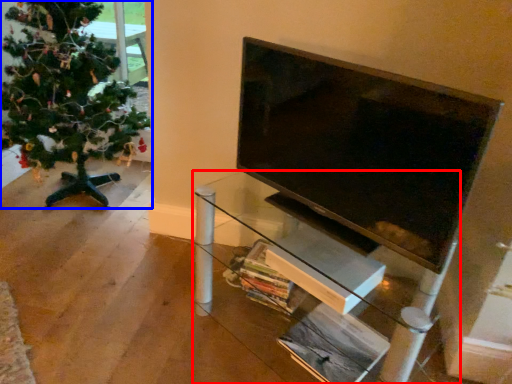
Question: Which of the following is the farthest to the observer, furniture (highlighted by a red box) or christmas tree (highlighted by a blue box)?

Choices:
 (A) furniture
 (B) christmas tree

Answer: (B)